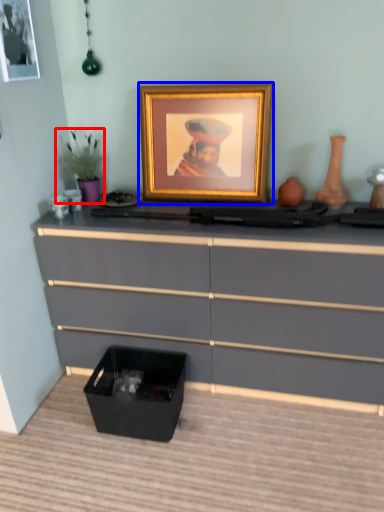
Question: Which object appears closest to the camera in this image, houseplant (highlighted by a red box) or picture frame (highlighted by a blue box)?

Choices:
 (A) houseplant
 (B) picture frame

Answer: (B)